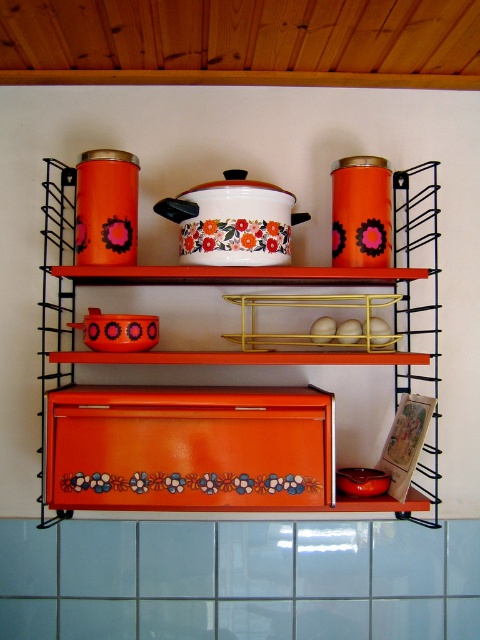
Does orange glossy canister at upper center have a lesser height compared to floral enamel pot at center?

Incorrect, orange glossy canister at upper center's height does not fall short of floral enamel pot at center's.

Which is behind, point (420, 200) or point (286, 216)?

Point (420, 200)

The width and height of the screenshot is (480, 640). Describe the element at coordinates (262, 276) in the screenshot. I see `orange glossy canister at upper center` at that location.

The width and height of the screenshot is (480, 640). In order to click on orange glossy canister at upper center in this screenshot , I will do `click(262, 276)`.